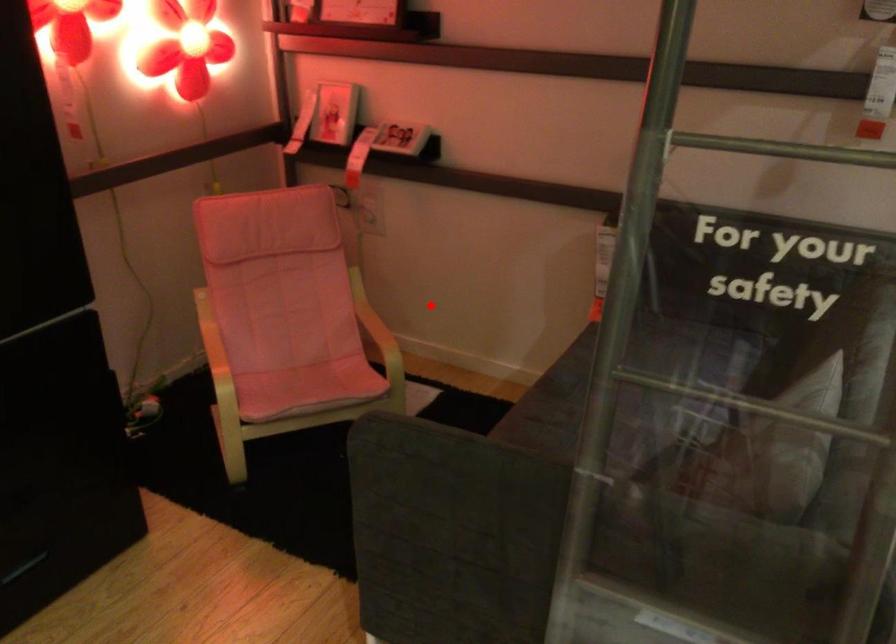
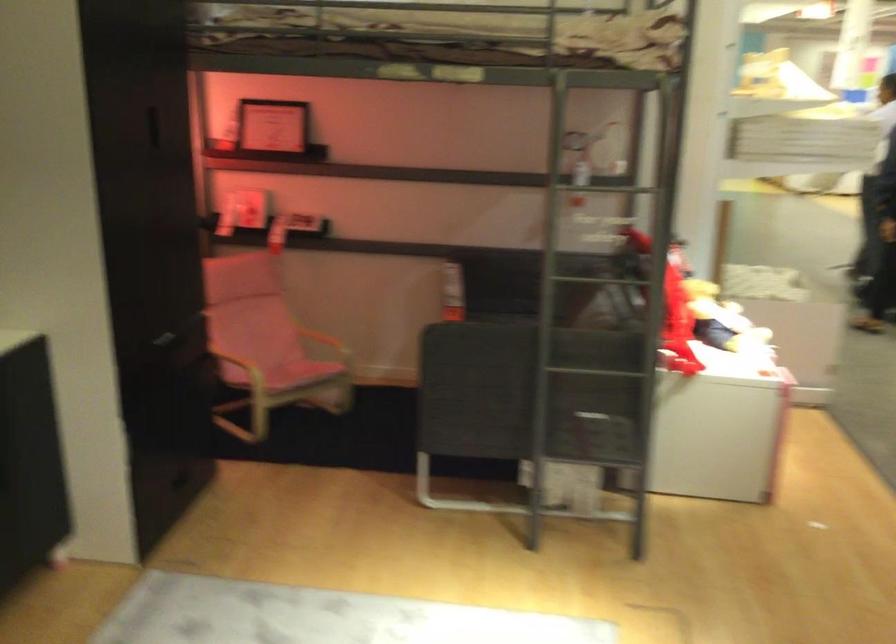
Question: I am providing you with two images of the same scene from different viewpoints. A red point is shown in image1. For the corresponding object point in image2, is it positioned nearer or farther from the camera?

Choices:
 (A) Nearer
 (B) Farther

Answer: (B)